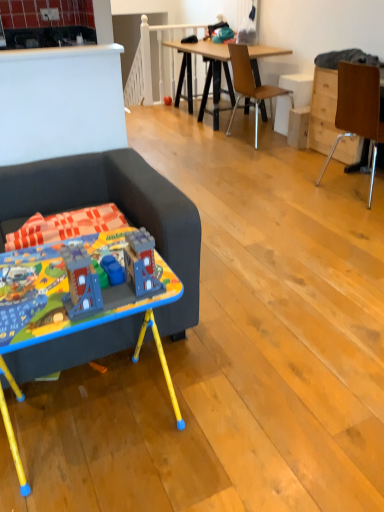
Question: From a real-world perspective, is matte plastic toy at center, which appears as the second toy when viewed from the front, positioned above or below wooden chair at right, acting as the 1th chair starting from the front?

Choices:
 (A) above
 (B) below

Answer: (B)

Question: Looking at the image, does matte plastic toy at center, which is the 1th toy in top-to-bottom order, seem bigger or smaller compared to wooden chair at right, the 1th chair when ordered from right to left?

Choices:
 (A) big
 (B) small

Answer: (B)

Question: Which object is positioned closest to the dark gray fabric couch at left?

Choices:
 (A) brown wooden chair at center, positioned as the 2th chair in front-to-back order
 (B) matte plastic toy at center, which appears as the second toy when viewed from the front
 (C) wooden drawer at right
 (D) wooden chair at right, which is counted as the second chair, starting from the left
 (E) blue plastic desk at lower left

Answer: (E)

Question: Which object is the farthest from the dark gray fabric couch at left?

Choices:
 (A) wooden drawer at right
 (B) blue plastic desk at lower left
 (C) matte plastic toy at center, which appears as the second toy when ordered from the bottom
 (D) wooden chair at right, the 1th chair when ordered from right to left
 (E) plastic toy castle at left, which appears as the 1th toy when ordered from the bottom

Answer: (C)